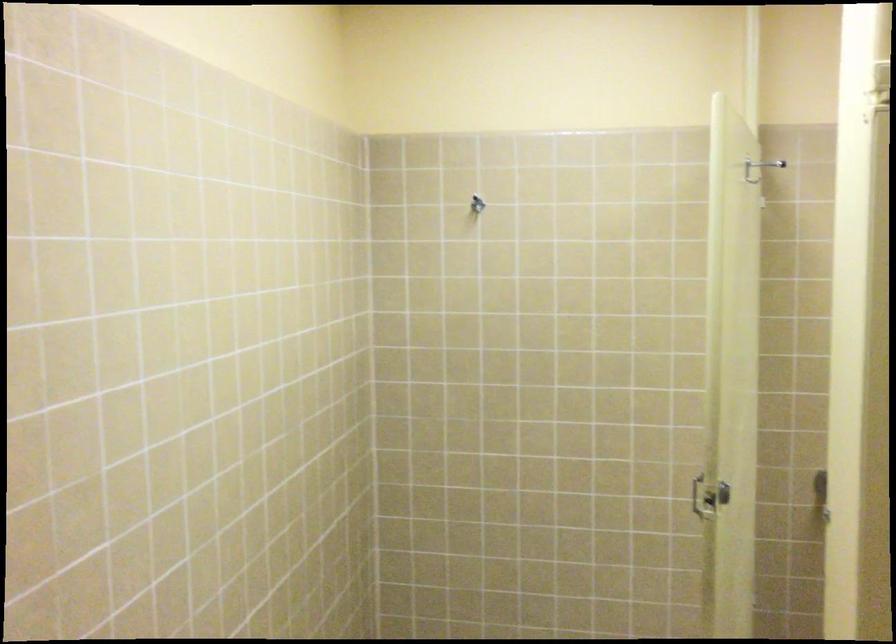
Find where to hang the metal wall hook. Please return your answer as a coordinate pair (x, y).

(477, 204)